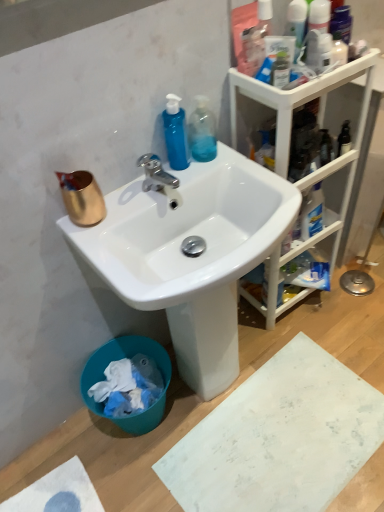
Find the location of `vacant area that lies in front of blue translucent bottle at upper center, positioned as the 2th cleaning product in right-to-left order`. vacant area that lies in front of blue translucent bottle at upper center, positioned as the 2th cleaning product in right-to-left order is located at coordinates (163, 190).